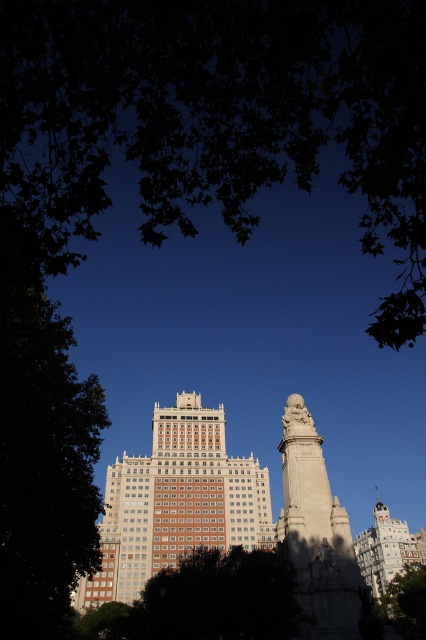
Looking at this image, you are standing in the park and want to take a photo of the white stone statue at center without the green leafy tree at lower right blocking the view. Which direction should you move to ensure the statue is visible without the tree in front of it?

You should move away from the green leafy tree at lower right so that the white stone statue at center, which is farther away, comes into view without the closer tree blocking it.

You are a city planner assessing the spacing between two green leafy trees in the urban scene. Given that the recommended minimum distance for tree spacing is 100 feet, can the current spacing between the green leafy tree at upper left and the green leafy tree at left meet the requirement?

The distance between the green leafy tree at upper left and the green leafy tree at left is 110.96 feet, which exceeds the recommended minimum of 100 feet. Therefore, the spacing meets the requirement.

You are standing at a viewpoint where the monument and the building are visible. The monument is closer to you than the building. If you want to take a photo focusing on the monument without the building blocking the view, is the point at coordinates point (167, 604) suitable for framing the monument?

The point at coordinates point (167, 604) is 81.36 meters away from you. Since the monument is closer than the building, this point would allow you to frame the monument without the building blocking the view as the distance to the monument is less than the building.